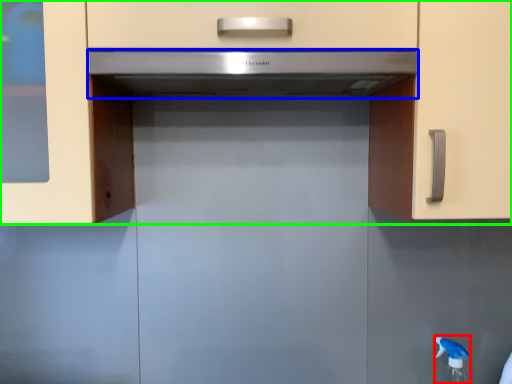
Question: Which object is positioned closest to faucet (highlighted by a red box)? Select from home appliance (highlighted by a blue box) and cabinetry (highlighted by a green box).

Choices:
 (A) home appliance
 (B) cabinetry

Answer: (B)